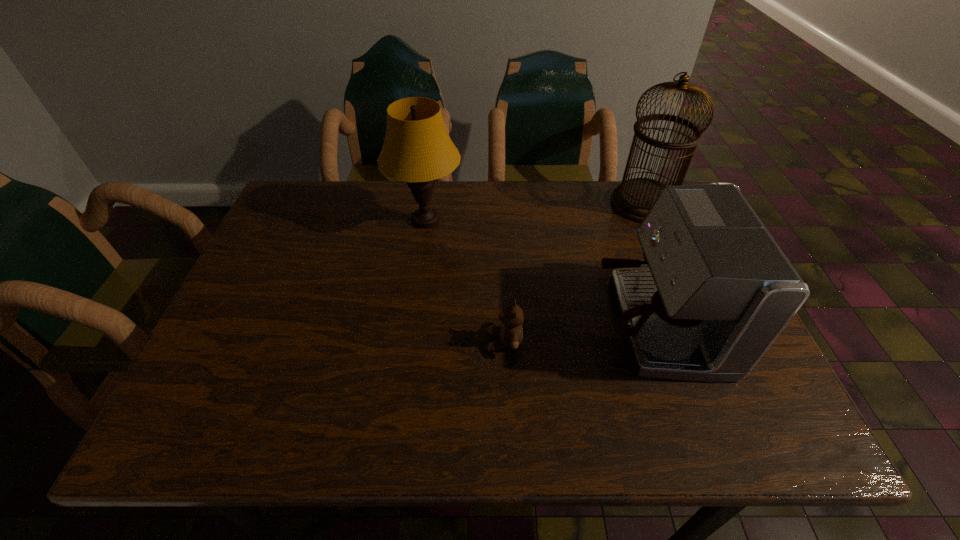
Identify the location of birdcage. This screenshot has height=540, width=960. (633, 198).

The width and height of the screenshot is (960, 540). I want to click on the leftmost object, so click(417, 149).

At what (x,y) coordinates should I click in order to perform the action: click on coffee maker. Please return your answer as a coordinate pair (x, y). Looking at the image, I should click on (719, 290).

What are the coordinates of `the shortest object` in the screenshot? It's located at (510, 333).

The height and width of the screenshot is (540, 960). What are the coordinates of `teddy bear` in the screenshot? It's located at (510, 333).

The width and height of the screenshot is (960, 540). In order to click on blank space located on the front-facing side of the birdcage in this screenshot , I will do `click(570, 204)`.

What are the coordinates of `free region located 0.400m on the front-facing side of the birdcage` in the screenshot? It's located at 474,204.

I want to click on vacant space situated 0.160m on the front-facing side of the birdcage, so click(x=557, y=204).

Where is `free space located 0.210m on the front of the leftmost object`? The height and width of the screenshot is (540, 960). free space located 0.210m on the front of the leftmost object is located at coordinates (415, 305).

At what (x,y) coordinates should I click in order to perform the action: click on vacant space positioned 0.380m on the front of the second shortest object near the spout. Please return your answer as a coordinate pair (x, y). This screenshot has width=960, height=540. Looking at the image, I should click on (423, 323).